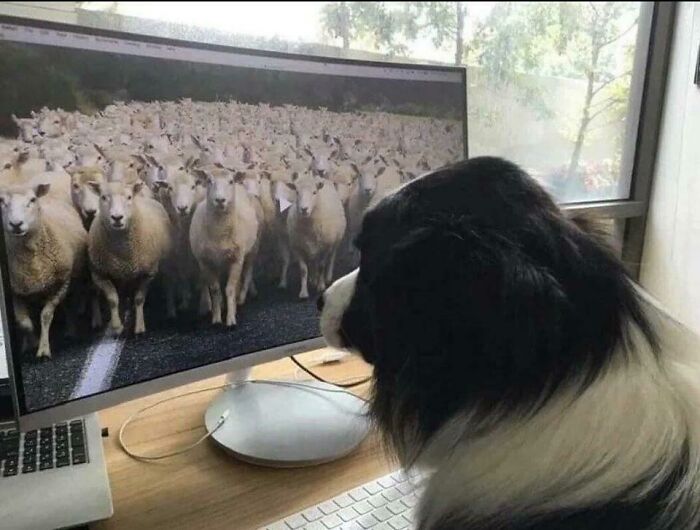
Where is `wires`? Image resolution: width=700 pixels, height=530 pixels. wires is located at coordinates (295, 376), (315, 376), (180, 449).